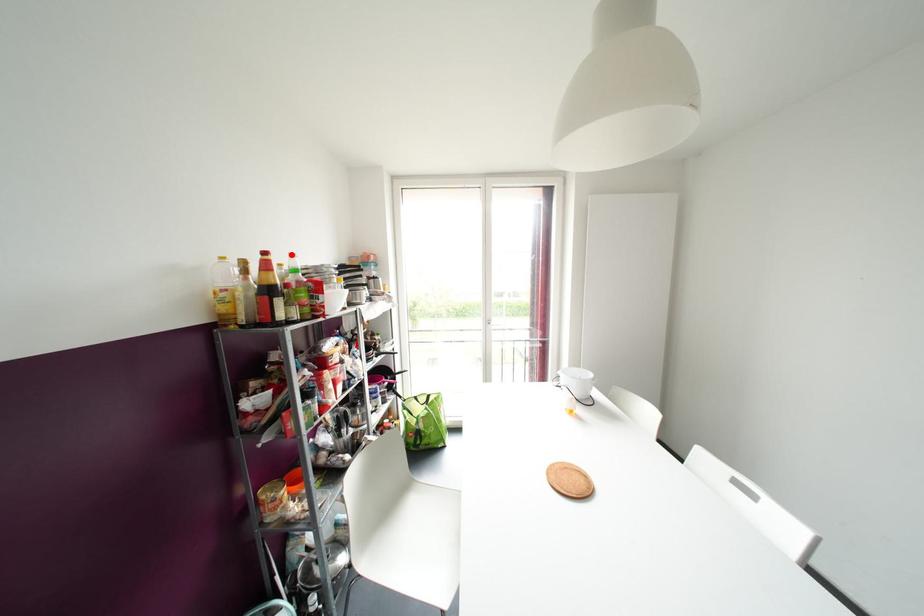
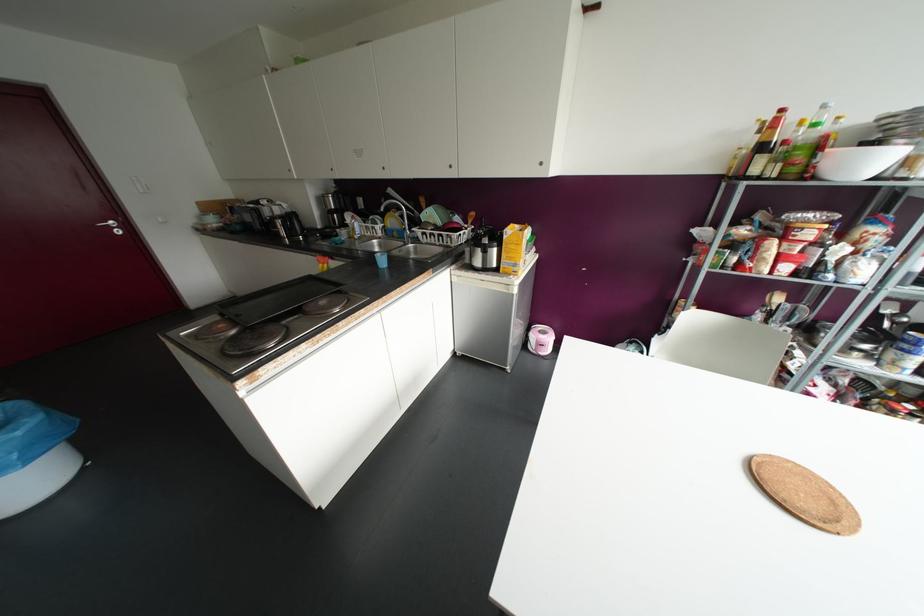
In the second image, find the point that corresponds to the highlighted location in the first image.

(823, 106)